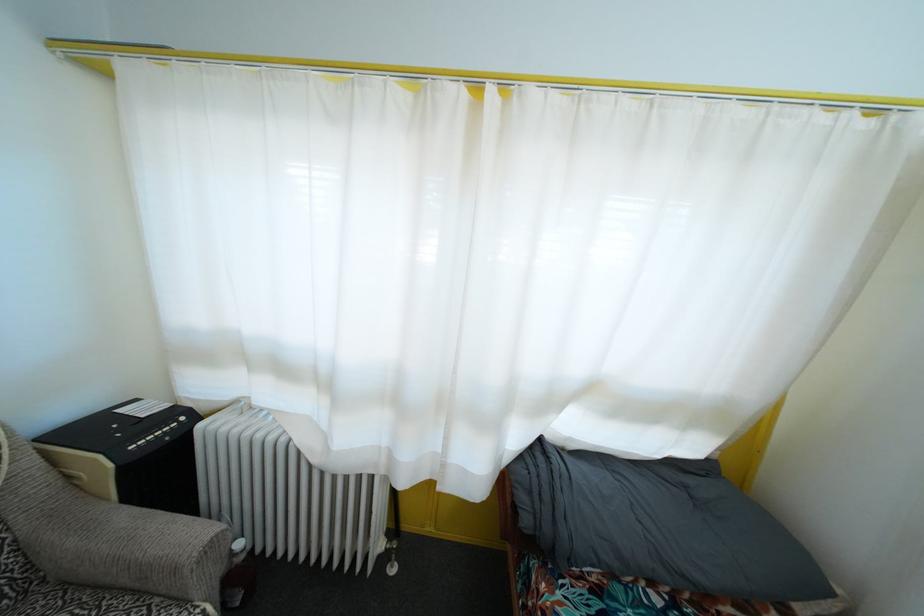
Where would you pull the grey blanket? Please return your answer as a coordinate pair (x, y).

(659, 524)